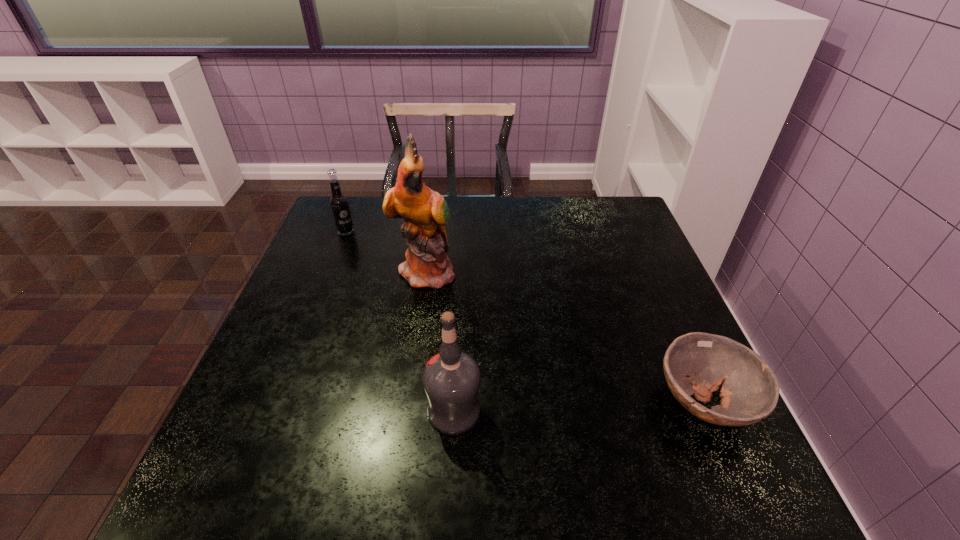
Identify the location of vacant space on the desktop that is between the third shortest object and the bowl and is positioned on the front-facing side of the second farthest object. (609, 405).

You are a GUI agent. You are given a task and a screenshot of the screen. Output one action in this format:
    pyautogui.click(x=<x>, y=<y>)
    Task: Click on the vacant space on the desktop that is between the vodka and the rightmost object and is positioned on the label of the root beer
    The height and width of the screenshot is (540, 960).
    Given the screenshot: What is the action you would take?
    pyautogui.click(x=547, y=407)